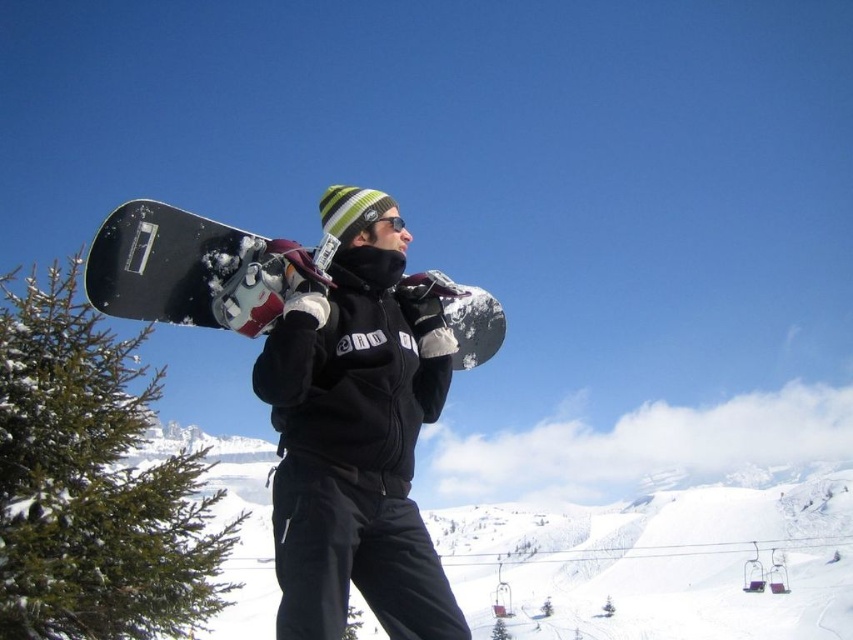
Question: Does white fluffy snow at center appear on the right side of black matte snowboard at upper center?

Choices:
 (A) no
 (B) yes

Answer: (B)

Question: Which object is the closest to the green matte pine at left?

Choices:
 (A) matte black snowboard at center
 (B) white fluffy snow at center
 (C) black matte snowboard at upper center

Answer: (A)

Question: Which object is positioned closest to the black matte snowboard at upper center?

Choices:
 (A) green matte pine at left
 (B) matte black snowboard at center
 (C) white fluffy snow at center
 (D) metallic purple ski lift at lower right

Answer: (B)

Question: Does green matte pine at left appear on the left side of metallic purple ski lift at lower right?

Choices:
 (A) no
 (B) yes

Answer: (B)

Question: Among these objects, which one is nearest to the camera?

Choices:
 (A) white fluffy snow at center
 (B) matte black snowboard at center
 (C) green matte pine at left

Answer: (B)

Question: Does green matte pine at left come in front of metallic purple ski lift at lower right?

Choices:
 (A) no
 (B) yes

Answer: (B)